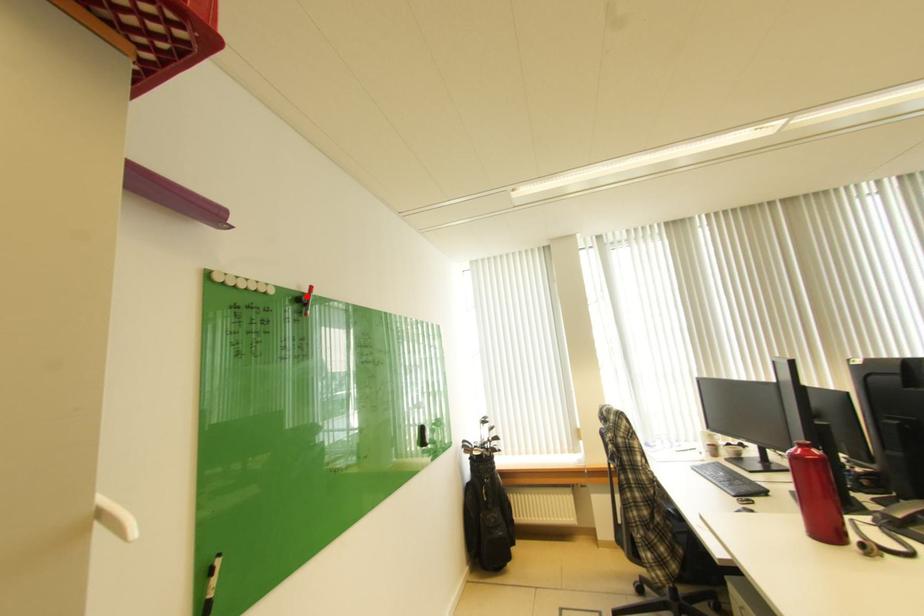
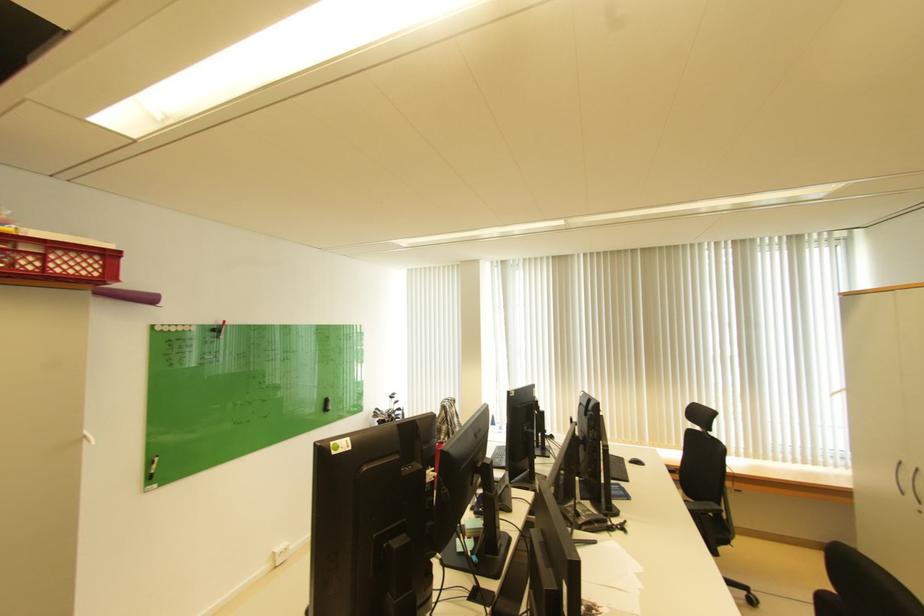
Question: I am providing you with two images of the same scene from different viewpoints. A red point is marked on the first image. Is the red point's position out of view in image 2?

Choices:
 (A) Yes
 (B) No

Answer: (B)